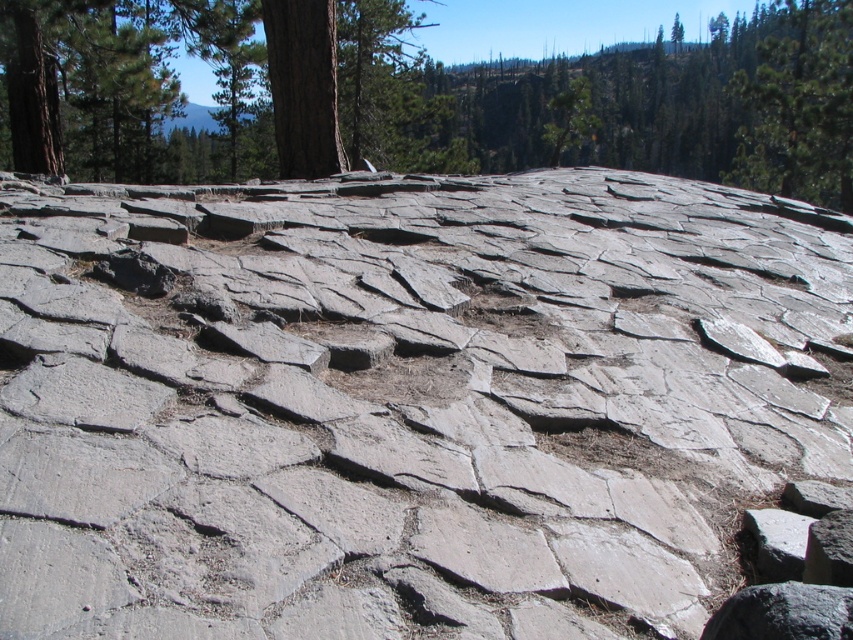
You are a geologist examining a rugged rocky surface. You notice a specific point marked at coordinates (404, 401). Based on the scene description, what type of rock feature is located at that point?

The point at coordinates (404, 401) corresponds to gray rough stone at center, which is a weathered rock feature with an irregular shape and rough texture typical of natural geological formations.

You are a hiker navigating through the rocky terrain and want to reach the brown rough tree at upper center. Based on the coordinates provided in the description, can you determine the direction you need to head from your current position at the center of the image?

The brown rough tree at upper center is located at coordinates point (x=614, y=100). Since your current position is at the center of the image, you should head towards the upper part of the image to reach the brown rough tree at upper center.

You are standing on the rugged rocky surface and want to move from the point at coordinates point [96,81] to the point at coordinates point [772,93]. Considering the uneven terrain with cracks and fissures, which direction should you move relative to the other point?

You should move towards the point at coordinates point [772,93], which is behind the point at coordinates point [96,81], as the latter is in front of the former according to their spatial arrangement.